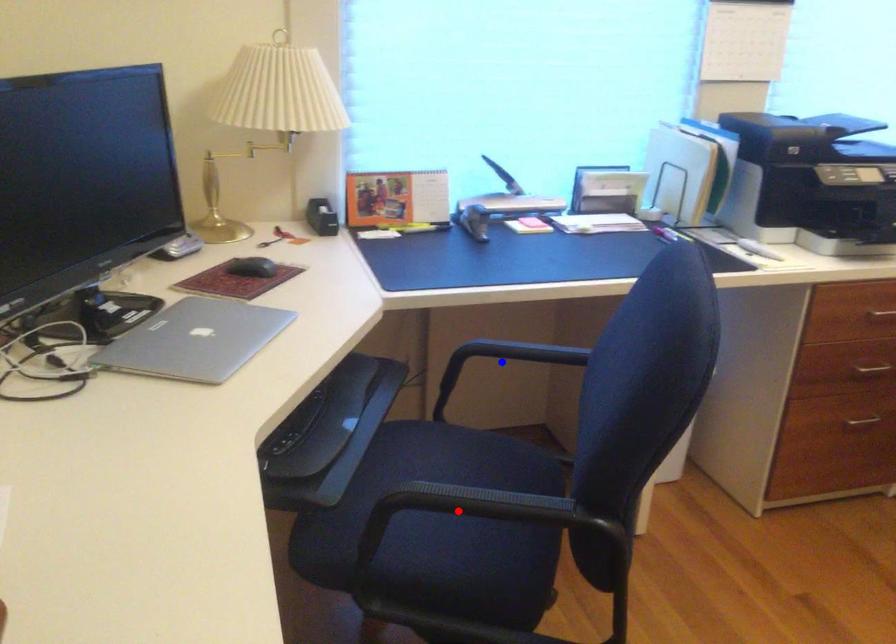
Question: Two points are marked on the image. Which point is closer to the camera?

Choices:
 (A) Blue point is closer.
 (B) Red point is closer.

Answer: (B)